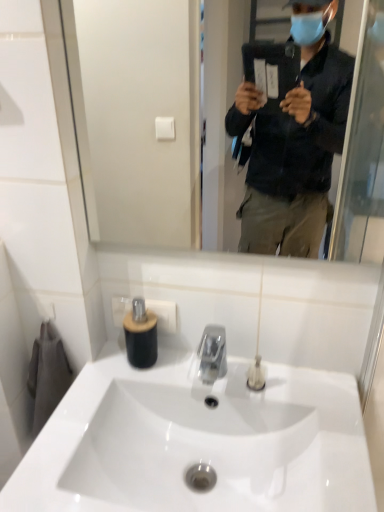
What are the coordinates of `clear glass mirror at upper center` in the screenshot? It's located at (154, 109).

The width and height of the screenshot is (384, 512). What do you see at coordinates (256, 375) in the screenshot? I see `clear plastic tube at center, which ranks as the 2th toiletry in left-to-right order` at bounding box center [256, 375].

This screenshot has height=512, width=384. Describe the element at coordinates (140, 335) in the screenshot. I see `black matte soap dispenser at center, which is counted as the 1th toiletry, starting from the left` at that location.

Image resolution: width=384 pixels, height=512 pixels. I want to click on clear glass mirror at upper center, so click(154, 109).

Considering the relative sizes of clear glass mirror at upper center and clear plastic tube at center, which ranks as the 2th toiletry in left-to-right order, in the image provided, is clear glass mirror at upper center wider than clear plastic tube at center, which ranks as the 2th toiletry in left-to-right order,?

No.

Who is smaller, clear glass mirror at upper center or clear plastic tube at center, which ranks as the 2th toiletry in left-to-right order?

With smaller size is clear plastic tube at center, which ranks as the 2th toiletry in left-to-right order.

At what (x,y) coordinates should I click in order to perform the action: click on mirror above the clear plastic tube at center, the 1th toiletry viewed from the right (from the image's perspective). Please return your answer as a coordinate pair (x, y). Looking at the image, I should click on (154, 109).

Is there a large distance between clear glass mirror at upper center and clear plastic tube at center, which ranks as the 2th toiletry in left-to-right order?

Yes.

Which object is thinner, black matte soap dispenser at center, which is counted as the 1th toiletry, starting from the left, or white glossy sink at center?

black matte soap dispenser at center, which is counted as the 1th toiletry, starting from the left, is thinner.

From a real-world perspective, which is physically above, black matte soap dispenser at center, which is counted as the second toiletry, starting from the right, or white glossy sink at center?

black matte soap dispenser at center, which is counted as the second toiletry, starting from the right.

From the image's perspective, does black matte soap dispenser at center, which is counted as the 1th toiletry, starting from the left, appear lower than white glossy sink at center?

No, from the image's perspective, black matte soap dispenser at center, which is counted as the 1th toiletry, starting from the left, is not beneath white glossy sink at center.

The image size is (384, 512). Identify the location of sink below the black matte soap dispenser at center, which is counted as the second toiletry, starting from the right (from a real-world perspective). (197, 441).

From the image's perspective, which object appears higher, black matte soap dispenser at center, which is counted as the 1th toiletry, starting from the left, or clear glass mirror at upper center?

clear glass mirror at upper center, from the image's perspective.

Is black matte soap dispenser at center, which is counted as the second toiletry, starting from the right, facing towards clear glass mirror at upper center?

No, black matte soap dispenser at center, which is counted as the second toiletry, starting from the right, does not turn towards clear glass mirror at upper center.

From a real-world perspective, count 1st toiletrys downward from the clear glass mirror at upper center and point to it. Please provide its 2D coordinates.

[(140, 335)]

Considering the sizes of black matte soap dispenser at center, which is counted as the second toiletry, starting from the right, and clear glass mirror at upper center in the image, is black matte soap dispenser at center, which is counted as the second toiletry, starting from the right, wider or thinner than clear glass mirror at upper center?

Clearly, black matte soap dispenser at center, which is counted as the second toiletry, starting from the right, has more width compared to clear glass mirror at upper center.

From the image's perspective, which object appears higher, black matte soap dispenser at center, which is counted as the 1th toiletry, starting from the left, or clear plastic tube at center, which ranks as the 2th toiletry in left-to-right order?

black matte soap dispenser at center, which is counted as the 1th toiletry, starting from the left.

Which object is wider, black matte soap dispenser at center, which is counted as the second toiletry, starting from the right, or clear plastic tube at center, the 1th toiletry viewed from the right?

Wider between the two is black matte soap dispenser at center, which is counted as the second toiletry, starting from the right.

Is black matte soap dispenser at center, which is counted as the 1th toiletry, starting from the left, taller or shorter than clear plastic tube at center, the 1th toiletry viewed from the right?

Clearly, black matte soap dispenser at center, which is counted as the 1th toiletry, starting from the left, is taller compared to clear plastic tube at center, the 1th toiletry viewed from the right.

Is black matte soap dispenser at center, which is counted as the second toiletry, starting from the right, positioned before clear plastic tube at center, which ranks as the 2th toiletry in left-to-right order?

That is False.

Considering the sizes of objects clear plastic tube at center, the 1th toiletry viewed from the right, and clear glass mirror at upper center in the image provided, who is thinner, clear plastic tube at center, the 1th toiletry viewed from the right, or clear glass mirror at upper center?

clear glass mirror at upper center is thinner.

This screenshot has width=384, height=512. I want to click on toiletry on the right of the clear glass mirror at upper center, so click(256, 375).

Considering the sizes of objects clear plastic tube at center, the 1th toiletry viewed from the right, and clear glass mirror at upper center in the image provided, who is smaller, clear plastic tube at center, the 1th toiletry viewed from the right, or clear glass mirror at upper center?

clear plastic tube at center, the 1th toiletry viewed from the right.

From a real-world perspective, relative to clear glass mirror at upper center, is clear plastic tube at center, the 1th toiletry viewed from the right, vertically above or below?

From a real-world perspective, clear plastic tube at center, the 1th toiletry viewed from the right, is physically below clear glass mirror at upper center.

Can you confirm if white glossy sink at center is positioned to the right of black matte soap dispenser at center, which is counted as the 1th toiletry, starting from the left?

Yes, white glossy sink at center is to the right of black matte soap dispenser at center, which is counted as the 1th toiletry, starting from the left.

Can you confirm if white glossy sink at center is thinner than black matte soap dispenser at center, which is counted as the second toiletry, starting from the right?

No, white glossy sink at center is not thinner than black matte soap dispenser at center, which is counted as the second toiletry, starting from the right.

Is white glossy sink at center oriented towards black matte soap dispenser at center, which is counted as the second toiletry, starting from the right?

No, white glossy sink at center is not facing towards black matte soap dispenser at center, which is counted as the second toiletry, starting from the right.

Is white glossy sink at center positioned before black matte soap dispenser at center, which is counted as the 1th toiletry, starting from the left?

Yes, it is in front of black matte soap dispenser at center, which is counted as the 1th toiletry, starting from the left.

Looking at this image, is clear plastic tube at center, which ranks as the 2th toiletry in left-to-right order, not near white glossy sink at center?

clear plastic tube at center, which ranks as the 2th toiletry in left-to-right order, is actually quite close to white glossy sink at center.

From the picture: Between clear plastic tube at center, which ranks as the 2th toiletry in left-to-right order, and white glossy sink at center, which one has less height?

clear plastic tube at center, which ranks as the 2th toiletry in left-to-right order, is shorter.

Would you say clear plastic tube at center, the 1th toiletry viewed from the right, is inside or outside white glossy sink at center?

clear plastic tube at center, the 1th toiletry viewed from the right, is located beyond the bounds of white glossy sink at center.

From a real-world perspective, which is physically below, clear plastic tube at center, the 1th toiletry viewed from the right, or white glossy sink at center?

white glossy sink at center is physically lower.

Image resolution: width=384 pixels, height=512 pixels. In order to click on the 1st toiletry behind the clear glass mirror at upper center in this screenshot , I will do `click(256, 375)`.

Image resolution: width=384 pixels, height=512 pixels. Find the location of `sink lying below the black matte soap dispenser at center, which is counted as the second toiletry, starting from the right (from the image's perspective)`. sink lying below the black matte soap dispenser at center, which is counted as the second toiletry, starting from the right (from the image's perspective) is located at coordinates (197, 441).

Estimate the real-world distances between objects in this image. Which object is further from white glossy sink at center, clear glass mirror at upper center or clear plastic tube at center, the 1th toiletry viewed from the right?

Based on the image, clear glass mirror at upper center appears to be further to white glossy sink at center.

When comparing their distances from clear plastic tube at center, the 1th toiletry viewed from the right, does clear glass mirror at upper center or black matte soap dispenser at center, which is counted as the second toiletry, starting from the right, seem further?

Among the two, clear glass mirror at upper center is located further to clear plastic tube at center, the 1th toiletry viewed from the right.

Based on their spatial positions, is clear plastic tube at center, the 1th toiletry viewed from the right, or white glossy sink at center further from black matte soap dispenser at center, which is counted as the 1th toiletry, starting from the left?

Among the two, clear plastic tube at center, the 1th toiletry viewed from the right, is located further to black matte soap dispenser at center, which is counted as the 1th toiletry, starting from the left.

Looking at the image, which one is located closer to white glossy sink at center, clear plastic tube at center, which ranks as the 2th toiletry in left-to-right order, or black matte soap dispenser at center, which is counted as the second toiletry, starting from the right?

Based on the image, clear plastic tube at center, which ranks as the 2th toiletry in left-to-right order, appears to be nearer to white glossy sink at center.

Estimate the real-world distances between objects in this image. Which object is further from white glossy sink at center, black matte soap dispenser at center, which is counted as the second toiletry, starting from the right, or clear plastic tube at center, the 1th toiletry viewed from the right?

Among the two, black matte soap dispenser at center, which is counted as the second toiletry, starting from the right, is located further to white glossy sink at center.

When comparing their distances from clear plastic tube at center, which ranks as the 2th toiletry in left-to-right order, does black matte soap dispenser at center, which is counted as the 1th toiletry, starting from the left, or clear glass mirror at upper center seem further?

clear glass mirror at upper center is further to clear plastic tube at center, which ranks as the 2th toiletry in left-to-right order.

Looking at the image, which one is located closer to clear plastic tube at center, which ranks as the 2th toiletry in left-to-right order, white glossy sink at center or black matte soap dispenser at center, which is counted as the second toiletry, starting from the right?

Among the two, white glossy sink at center is located nearer to clear plastic tube at center, which ranks as the 2th toiletry in left-to-right order.

Estimate the real-world distances between objects in this image. Which object is closer to black matte soap dispenser at center, which is counted as the second toiletry, starting from the right, clear glass mirror at upper center or white glossy sink at center?

Based on the image, white glossy sink at center appears to be nearer to black matte soap dispenser at center, which is counted as the second toiletry, starting from the right.

You are a GUI agent. You are given a task and a screenshot of the screen. Output one action in this format:
    pyautogui.click(x=<x>, y=<y>)
    Task: Click on the toiletry between white glossy sink at center and black matte soap dispenser at center, which is counted as the 1th toiletry, starting from the left, along the z-axis
    The image size is (384, 512).
    Given the screenshot: What is the action you would take?
    pyautogui.click(x=256, y=375)

Locate an element on the screen. The image size is (384, 512). toiletry between clear glass mirror at upper center and clear plastic tube at center, the 1th toiletry viewed from the right, in the vertical direction is located at coordinates (140, 335).